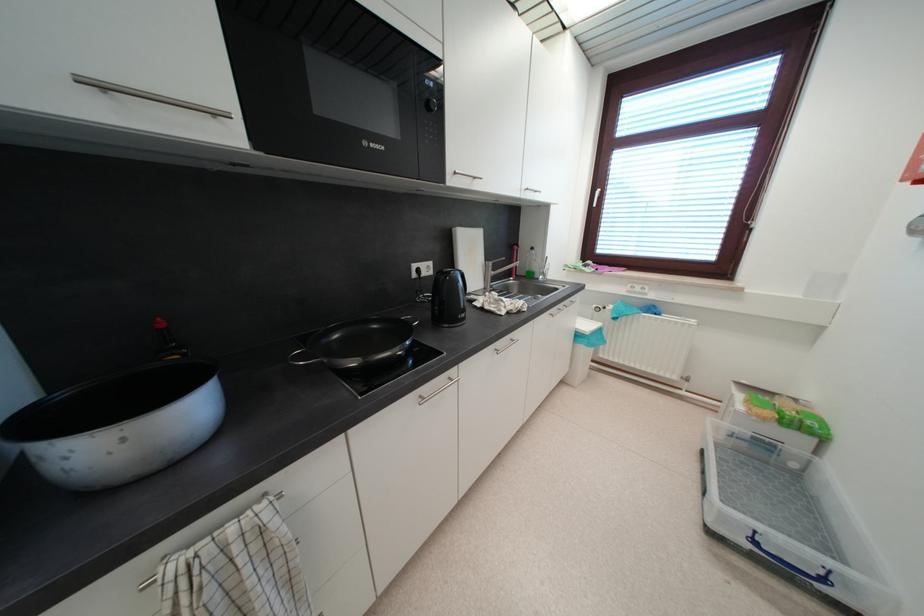
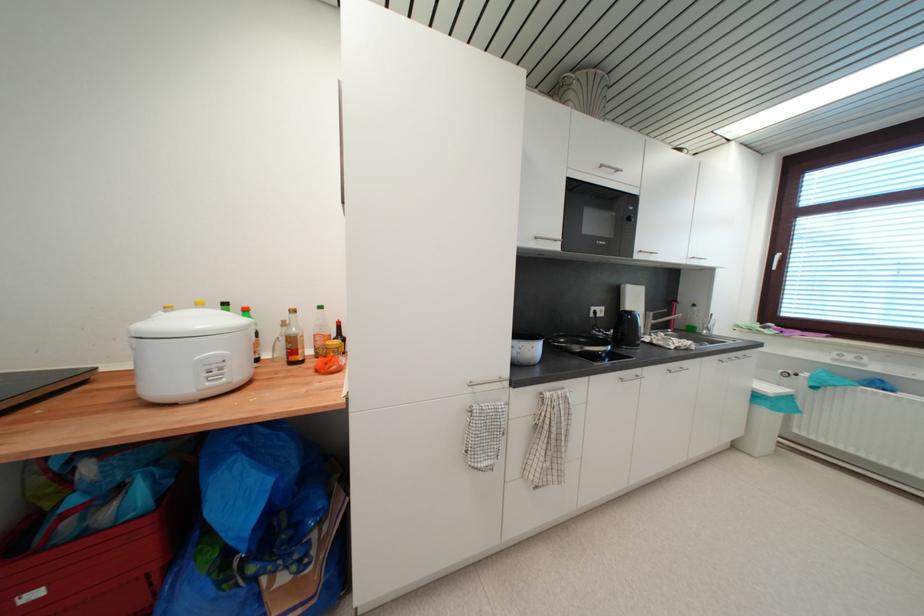
Where in the second image is the point corresponding to the point at 541,270 from the first image?

(701, 326)